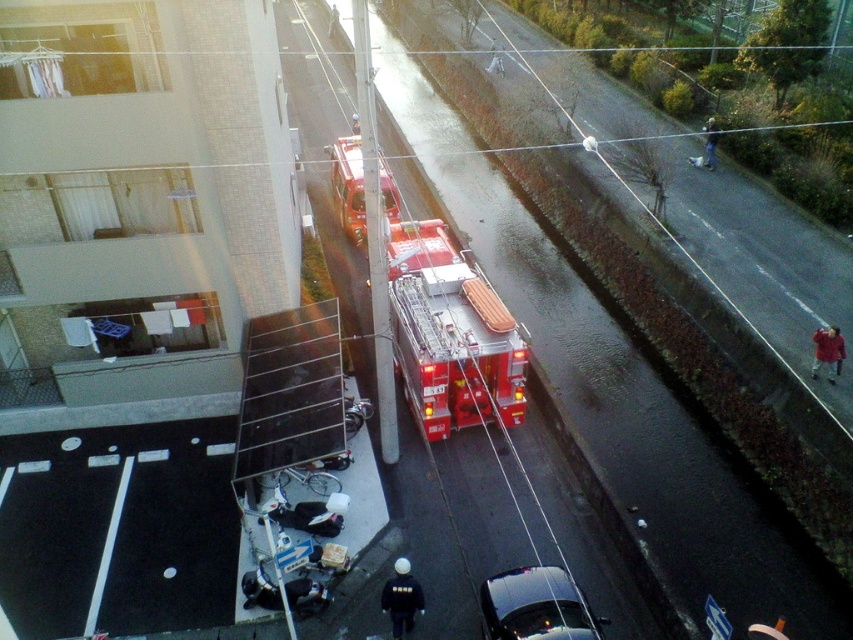
Question: Can you confirm if shiny red fire truck at center is positioned to the right of shiny black car at lower center?

Choices:
 (A) no
 (B) yes

Answer: (A)

Question: Which point is farther from the camera taking this photo?

Choices:
 (A) (535, 593)
 (B) (488, 390)

Answer: (B)

Question: Can you confirm if shiny red fire truck at center is thinner than shiny black car at lower center?

Choices:
 (A) yes
 (B) no

Answer: (B)

Question: Is shiny red fire truck at center positioned in front of shiny black car at lower center?

Choices:
 (A) yes
 (B) no

Answer: (B)

Question: Which object appears closest to the camera in this image?

Choices:
 (A) shiny black car at lower center
 (B) shiny red fire truck at center

Answer: (A)